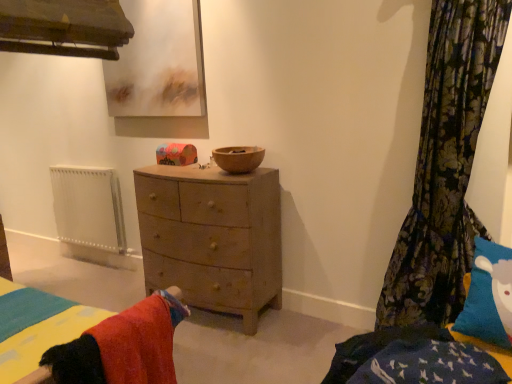
Question: From a real-world perspective, is soft cotton bed at center on white metallic radiator at left?

Choices:
 (A) no
 (B) yes

Answer: (B)

Question: From the image's perspective, is soft cotton bed at center located beneath white metallic radiator at left?

Choices:
 (A) yes
 (B) no

Answer: (A)

Question: Would you say soft cotton bed at center contains white metallic radiator at left?

Choices:
 (A) yes
 (B) no

Answer: (B)

Question: From a real-world perspective, is soft cotton bed at center below white metallic radiator at left?

Choices:
 (A) no
 (B) yes

Answer: (A)

Question: Can you confirm if soft cotton bed at center is positioned to the right of white metallic radiator at left?

Choices:
 (A) no
 (B) yes

Answer: (B)

Question: Would you say soft cotton bed at center is a long distance from white metallic radiator at left?

Choices:
 (A) yes
 (B) no

Answer: (A)

Question: Considering the relative sizes of floral fabric curtain at right and wooden chest of drawers at center in the image provided, is floral fabric curtain at right shorter than wooden chest of drawers at center?

Choices:
 (A) yes
 (B) no

Answer: (B)

Question: Is floral fabric curtain at right closer to camera compared to wooden chest of drawers at center?

Choices:
 (A) no
 (B) yes

Answer: (B)

Question: Does floral fabric curtain at right appear on the left side of wooden chest of drawers at center?

Choices:
 (A) yes
 (B) no

Answer: (B)

Question: Is floral fabric curtain at right next to wooden chest of drawers at center and touching it?

Choices:
 (A) no
 (B) yes

Answer: (A)

Question: From a real-world perspective, does floral fabric curtain at right sit lower than wooden chest of drawers at center?

Choices:
 (A) yes
 (B) no

Answer: (B)

Question: Considering the relative sizes of floral fabric curtain at right and wooden chest of drawers at center in the image provided, is floral fabric curtain at right taller than wooden chest of drawers at center?

Choices:
 (A) yes
 (B) no

Answer: (A)

Question: Is floral fabric curtain at right smaller than wooden bowl at center?

Choices:
 (A) no
 (B) yes

Answer: (A)